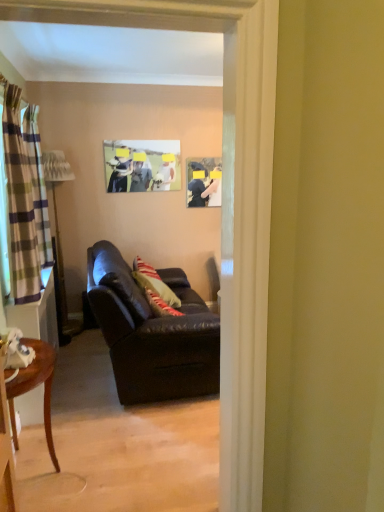
Question: From a real-world perspective, relative to leather couch at center, is striped fabric curtain at left, the 1th curtain in the front-to-back sequence, vertically above or below?

Choices:
 (A) above
 (B) below

Answer: (A)

Question: Considering the positions of point (36, 145) and point (117, 334), is point (36, 145) closer or farther from the camera than point (117, 334)?

Choices:
 (A) closer
 (B) farther

Answer: (A)

Question: Which object is positioned farthest from the striped fabric curtain at left, positioned as the second curtain in back-to-front order?

Choices:
 (A) matte black picture frame at upper center, acting as the first picture frame starting from the right
 (B) plaid fabric curtain at left, positioned as the 2th curtain in front-to-back order
 (C) leather couch at center
 (D) matte plastic picture frame at upper center, the second picture frame positioned from the right
 (E) mahogany wood side table at lower left

Answer: (A)

Question: Estimate the real-world distances between objects in this image. Which object is farther from the plaid fabric curtain at left, positioned as the 1th curtain in left-to-right order?

Choices:
 (A) matte black picture frame at upper center, acting as the second picture frame starting from the left
 (B) striped fabric curtain at left, the 1th curtain in the front-to-back sequence
 (C) matte plastic picture frame at upper center, which is the first picture frame in left-to-right order
 (D) leather couch at center
 (E) mahogany wood side table at lower left

Answer: (A)